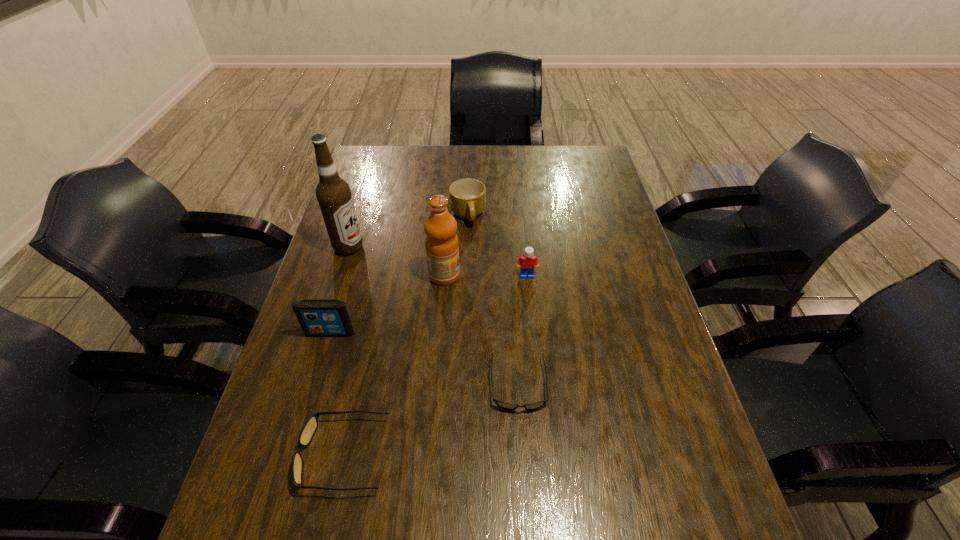
Where is `alcohol present at the left edge`? alcohol present at the left edge is located at coordinates (333, 193).

Identify the location of iPod that is at the left edge. (317, 317).

Where is `object that is at the near left corner`? The width and height of the screenshot is (960, 540). object that is at the near left corner is located at coordinates (x=309, y=428).

Identify the location of vacant space at the far edge of the desktop. The image size is (960, 540). (483, 168).

At what (x,y) coordinates should I click in order to perform the action: click on vacant space at the near edge. Please return your answer as a coordinate pair (x, y). The height and width of the screenshot is (540, 960). Looking at the image, I should click on (493, 480).

Locate an element on the screen. The image size is (960, 540). vacant space at the right edge of the desktop is located at coordinates (661, 352).

I want to click on vacant region at the far left corner of the desktop, so click(384, 155).

The width and height of the screenshot is (960, 540). Find the location of `vacant space at the near left corner`. vacant space at the near left corner is located at coordinates (259, 458).

In the image, there is a desktop. What are the coordinates of `vacant space at the near right corner` in the screenshot? It's located at (701, 476).

The width and height of the screenshot is (960, 540). I want to click on free space between the shorter sunglasses and the Lego, so click(522, 330).